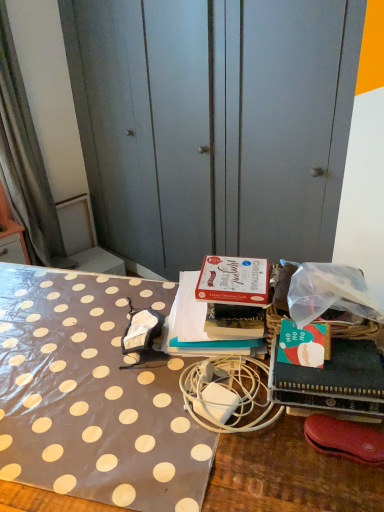
Locate an element on the screen. Image resolution: width=384 pixels, height=512 pixels. free space to the left of matte cardboard box at center, the 1th book in the back-to-front sequence is located at coordinates (99, 321).